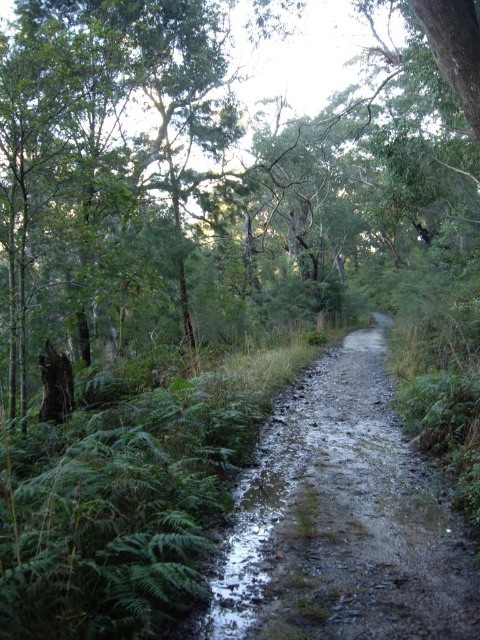
Question: Can you confirm if brown rough tree at center is positioned above muddy gravel path at center?

Choices:
 (A) yes
 (B) no

Answer: (A)

Question: Which object appears closest to the camera in this image?

Choices:
 (A) muddy gravel path at center
 (B) brown rough tree at center

Answer: (A)

Question: Can you confirm if brown rough tree at center is positioned below muddy gravel path at center?

Choices:
 (A) no
 (B) yes

Answer: (A)

Question: Does brown rough tree at center have a larger size compared to muddy gravel path at center?

Choices:
 (A) yes
 (B) no

Answer: (A)

Question: Which of the following is the farthest from the observer?

Choices:
 (A) brown rough tree at center
 (B) muddy gravel path at center

Answer: (A)